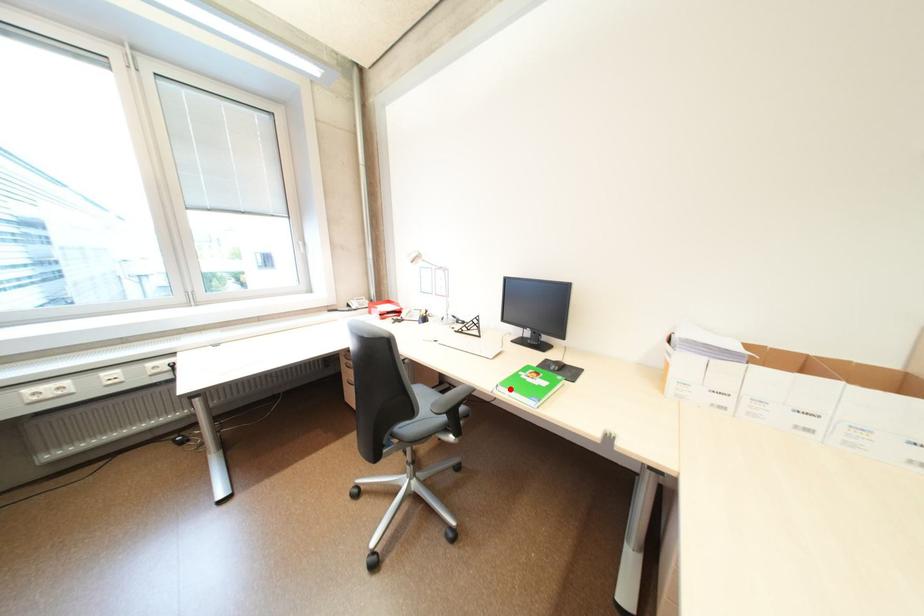
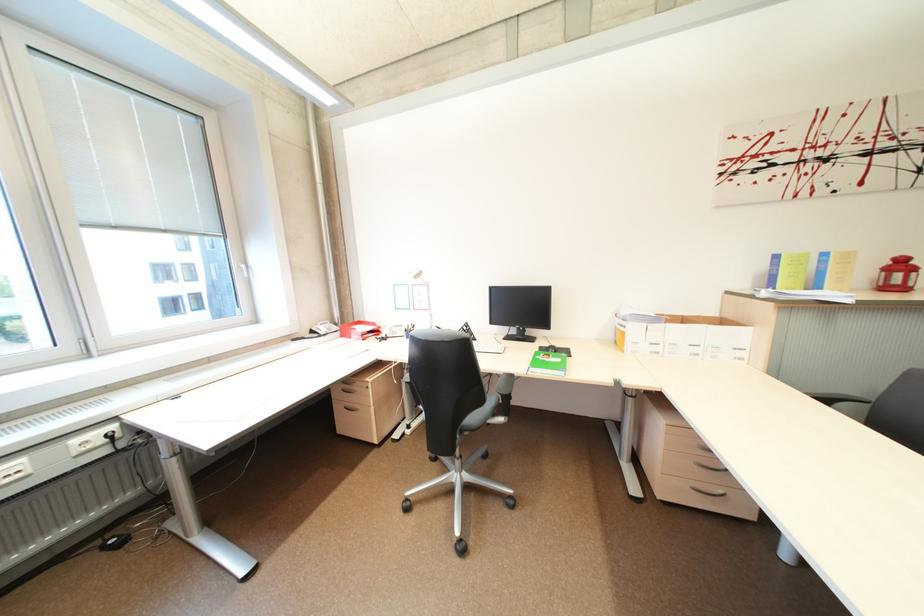
Find the pixel in the second image that matches the highlighted location in the first image.

(541, 370)